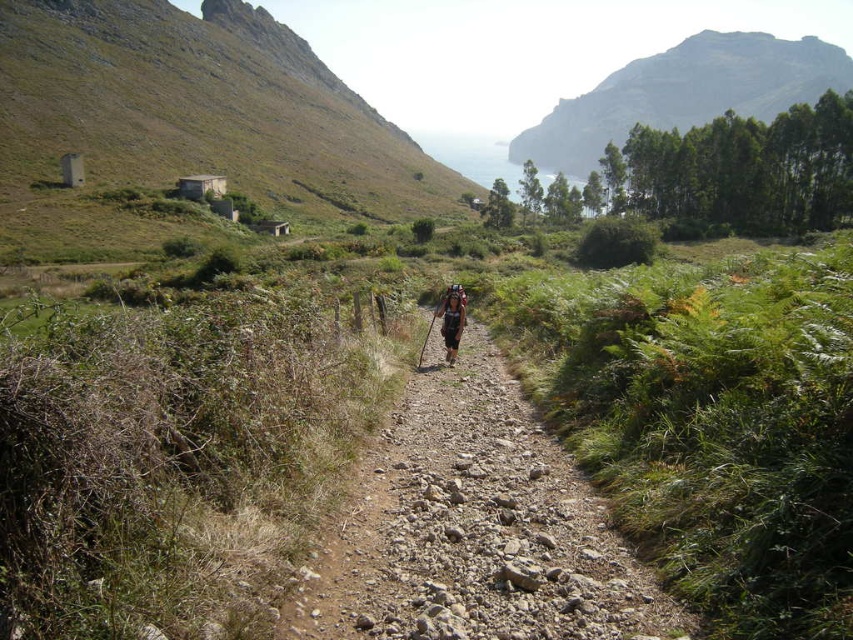
You are a hiker trying to navigate the rugged landscape. You see the dusty gravel trail at center and the dark brown leather backpack at center. Which object is positioned to the right side of the other?

The dusty gravel trail at center is to the right of the dark brown leather backpack at center.

You are a hiker who wants to take a photo of the dark brown leather backpack at center and the green rocky mountain at upper center. Since you want both objects in the frame, which one should you move closer to first?

The dark brown leather backpack at center is behind the green rocky mountain at upper center, so you should move closer to the green rocky mountain at upper center first to ensure both are visible in the frame.

You are a hiker standing at the starting point of the path. You notice two points marked on the path ahead of you. The first point is at coordinates point (473, 384) and the second is at point (456, 284). Which point is closer to you as you begin your hike?

Point (473, 384) is closer to the viewer than point (456, 284), so the first point is closer to you as you begin your hike.